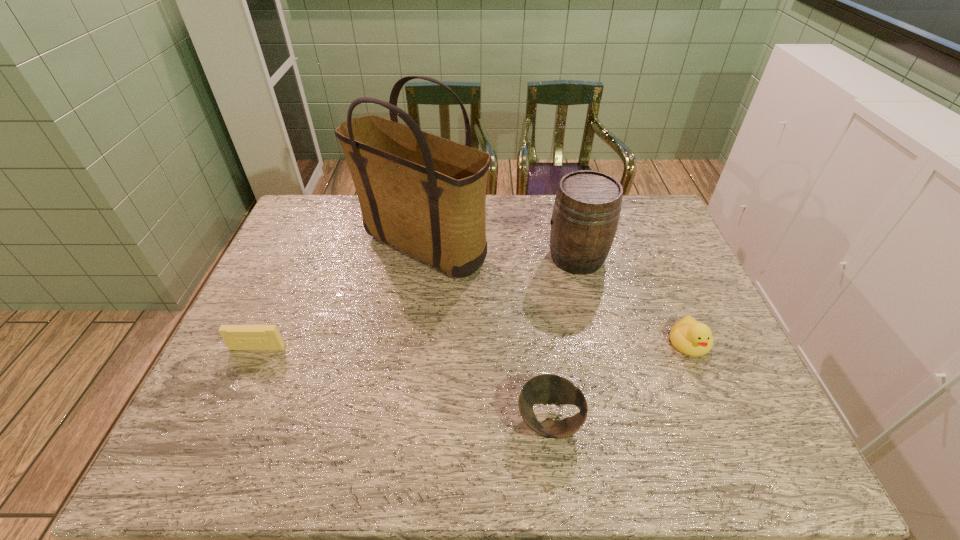
The width and height of the screenshot is (960, 540). Identify the location of vacant space at the far left corner of the desktop. (292, 222).

Locate an element on the screen. This screenshot has height=540, width=960. vacant region at the near left corner of the desktop is located at coordinates (250, 454).

The height and width of the screenshot is (540, 960). In the image, there is a desktop. Find the location of `vacant space at the near right corner`. vacant space at the near right corner is located at coordinates [x=715, y=468].

In order to click on free area in between the videotape and the cider in this screenshot , I will do `click(418, 302)`.

Locate an element on the screen. vacant space that's between the rightmost object and the leftmost object is located at coordinates (473, 345).

Where is `unoccupied area between the fourth object from right to left and the nearest object`? Image resolution: width=960 pixels, height=540 pixels. unoccupied area between the fourth object from right to left and the nearest object is located at coordinates (486, 334).

Locate an element on the screen. Image resolution: width=960 pixels, height=540 pixels. free space between the fourth shortest object and the duckling is located at coordinates (634, 300).

The width and height of the screenshot is (960, 540). Find the location of `vacant region between the rightmost object and the second object from left to right`. vacant region between the rightmost object and the second object from left to right is located at coordinates (556, 295).

The height and width of the screenshot is (540, 960). Identify the location of empty space that is in between the nearest object and the fourth shortest object. (564, 339).

The image size is (960, 540). Find the location of `vacant space in between the fourth shortest object and the videotape`. vacant space in between the fourth shortest object and the videotape is located at coordinates (418, 302).